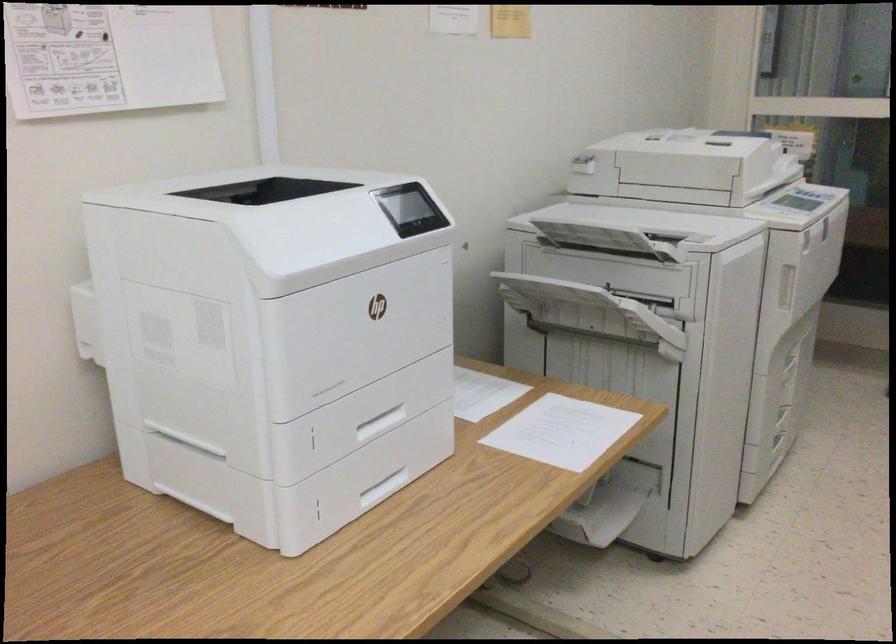
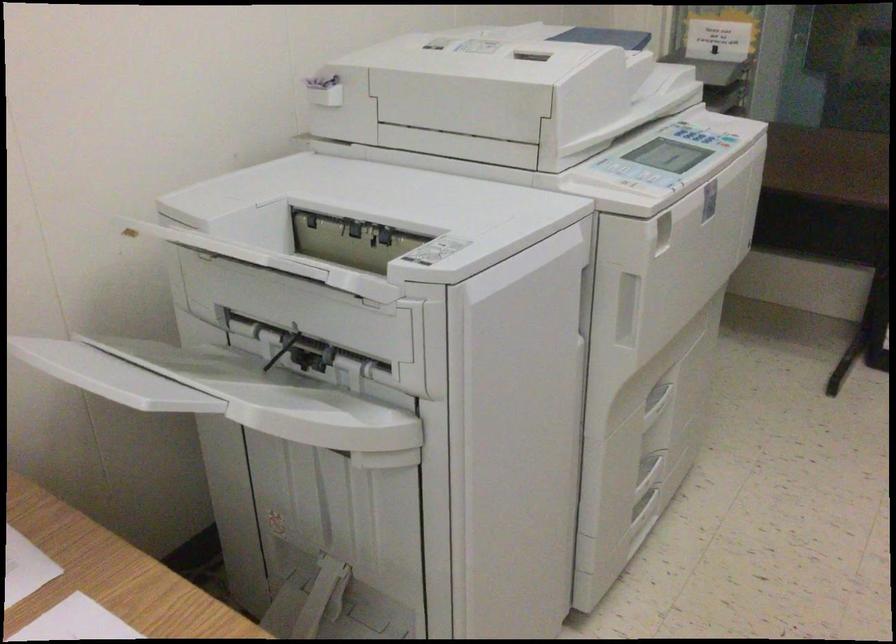
Where in the second image is the point corresponding to point 694,238 from the first image?

(435, 251)